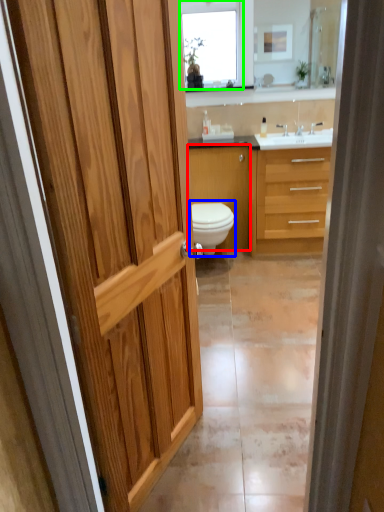
Question: Considering the real-world distances, which object is farthest from cabinetry (highlighted by a red box)? toilet (highlighted by a blue box) or window (highlighted by a green box)?

Choices:
 (A) toilet
 (B) window

Answer: (B)